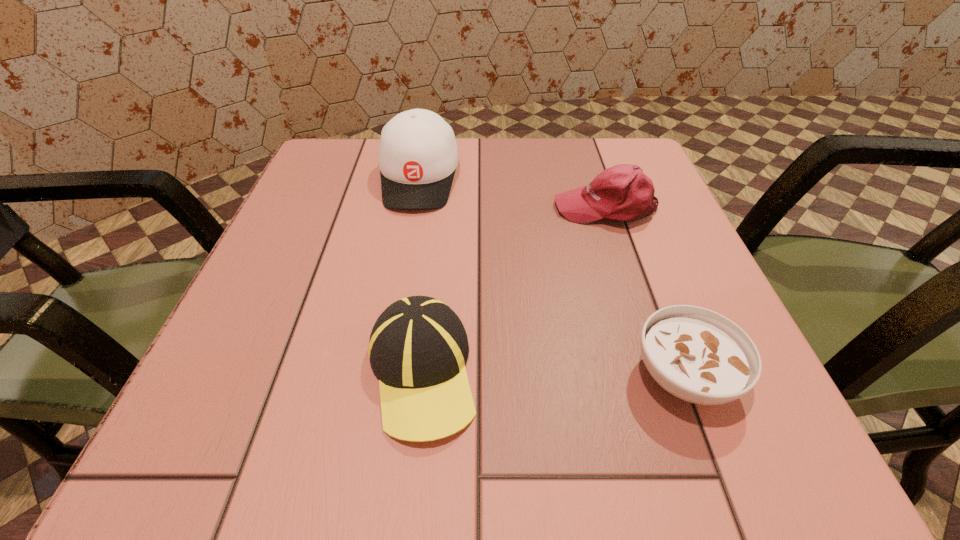
Locate an element on the screen. The height and width of the screenshot is (540, 960). vacant space that satisfies the following two spatial constraints: 1. at the front of the rightmost baseball cap with the brim; 2. with the brim of the nearest baseball cap facing forward is located at coordinates (661, 373).

Image resolution: width=960 pixels, height=540 pixels. Find the location of `vacant space that satisfies the following two spatial constraints: 1. at the front of the rightmost baseball cap with the brim; 2. with the brim of the nearest baseball cap facing forward`. vacant space that satisfies the following two spatial constraints: 1. at the front of the rightmost baseball cap with the brim; 2. with the brim of the nearest baseball cap facing forward is located at coordinates (661, 373).

Find the location of a particular element. The image size is (960, 540). vacant area in the image that satisfies the following two spatial constraints: 1. at the front of the rightmost baseball cap with the brim; 2. with the brim of the nearest baseball cap facing forward is located at coordinates (661, 373).

At what (x,y) coordinates should I click in order to perform the action: click on free space in the image that satisfies the following two spatial constraints: 1. at the front of the rightmost baseball cap with the brim; 2. on the right side of the shortest object. Please return your answer as a coordinate pair (x, y). The height and width of the screenshot is (540, 960). Looking at the image, I should click on (662, 376).

At what (x,y) coordinates should I click in order to perform the action: click on free space that satisfies the following two spatial constraints: 1. on the front-facing side of the soup bowl; 2. on the right side of the tallest object. Please return your answer as a coordinate pair (x, y). Looking at the image, I should click on pyautogui.click(x=384, y=376).

Where is `vacant region that satisfies the following two spatial constraints: 1. at the front of the rightmost baseball cap with the brim; 2. on the left side of the soup bowl`? The width and height of the screenshot is (960, 540). vacant region that satisfies the following two spatial constraints: 1. at the front of the rightmost baseball cap with the brim; 2. on the left side of the soup bowl is located at coordinates (662, 376).

Image resolution: width=960 pixels, height=540 pixels. Identify the location of free space that satisfies the following two spatial constraints: 1. with the brim of the shortest object facing forward; 2. on the right side of the nearest baseball cap. (421, 376).